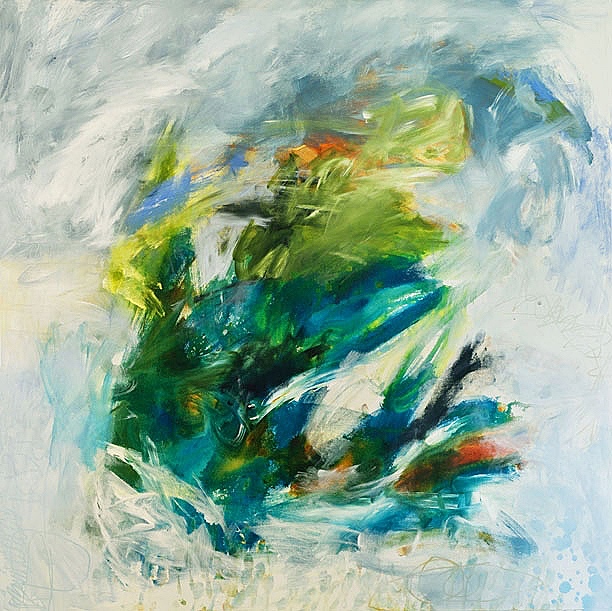
This screenshot has height=611, width=612. I want to click on artwork, so click(x=557, y=472).